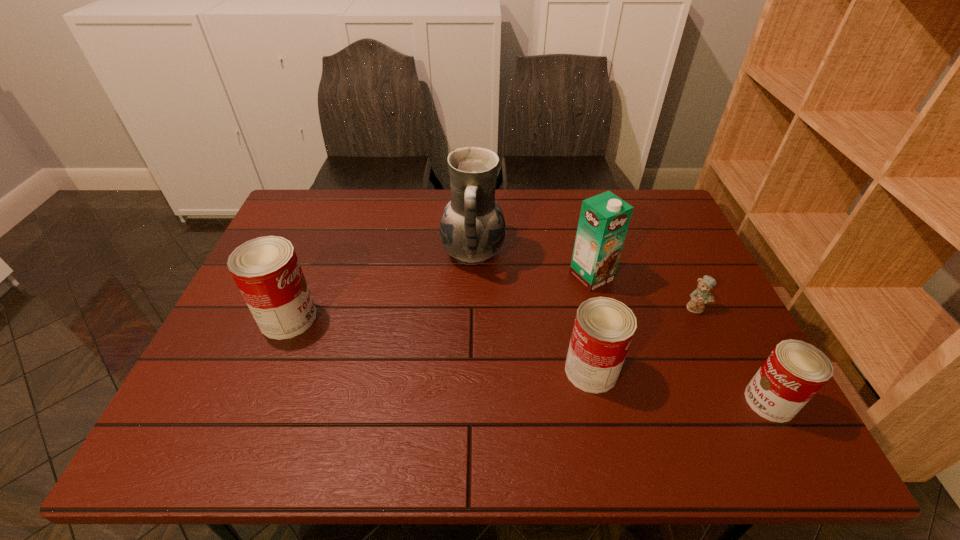
Please point a location where one more can can be added evenly. Please provide its 2D coordinates. Your answer should be formatted as a tuple, i.e. [(x, y)], where the tuple contains the x and y coordinates of a point satisfying the conditions above.

[(432, 343)]